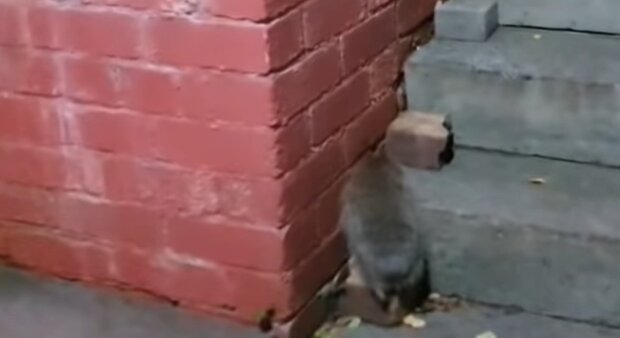
The height and width of the screenshot is (338, 620). Identify the location of stairs. (551, 225), (558, 76).